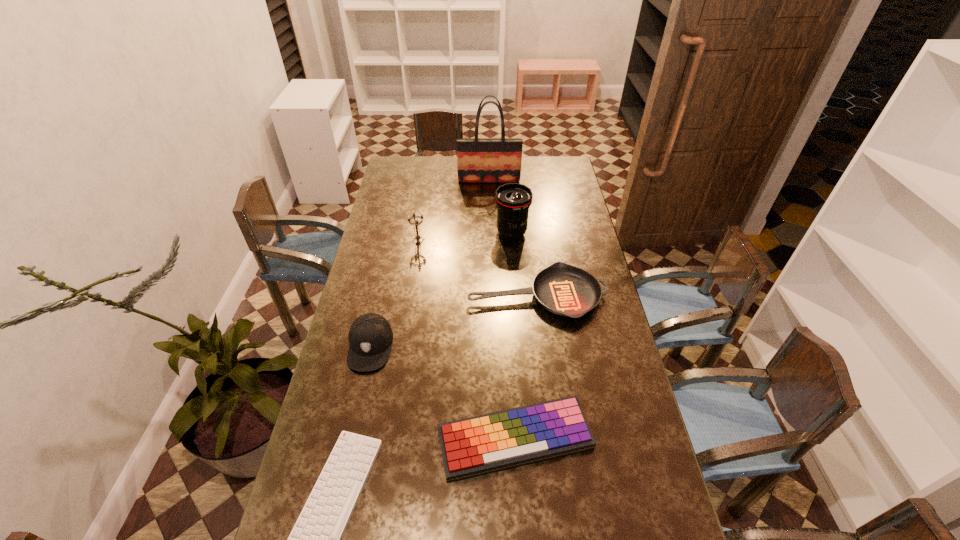
Locate an element on the screen. The height and width of the screenshot is (540, 960). vacant space positioned 0.370m on the front-facing side of the fourth shortest object is located at coordinates (336, 500).

Find the location of a particular element. The image size is (960, 540). vacant space situated 0.090m on the left of the taller computer keyboard is located at coordinates coord(405,440).

Where is `free point located on the front of the frying pan`? free point located on the front of the frying pan is located at coordinates (547, 373).

Where is `object located at the far edge`? object located at the far edge is located at coordinates (479, 160).

Image resolution: width=960 pixels, height=540 pixels. I want to click on object present at the left edge, so click(370, 336).

Identify the location of computer keyboard that is positioned at the right edge. (482, 444).

Locate an element on the screen. This screenshot has height=540, width=960. frying pan present at the right edge is located at coordinates (563, 289).

Find the location of a particular element. The width and height of the screenshot is (960, 540). vacant space at the far edge of the desktop is located at coordinates (531, 171).

Image resolution: width=960 pixels, height=540 pixels. What are the coordinates of `vacant space at the left edge of the desktop` in the screenshot? It's located at (406, 211).

Where is `free location at the right edge of the desktop`? Image resolution: width=960 pixels, height=540 pixels. free location at the right edge of the desktop is located at coordinates (611, 428).